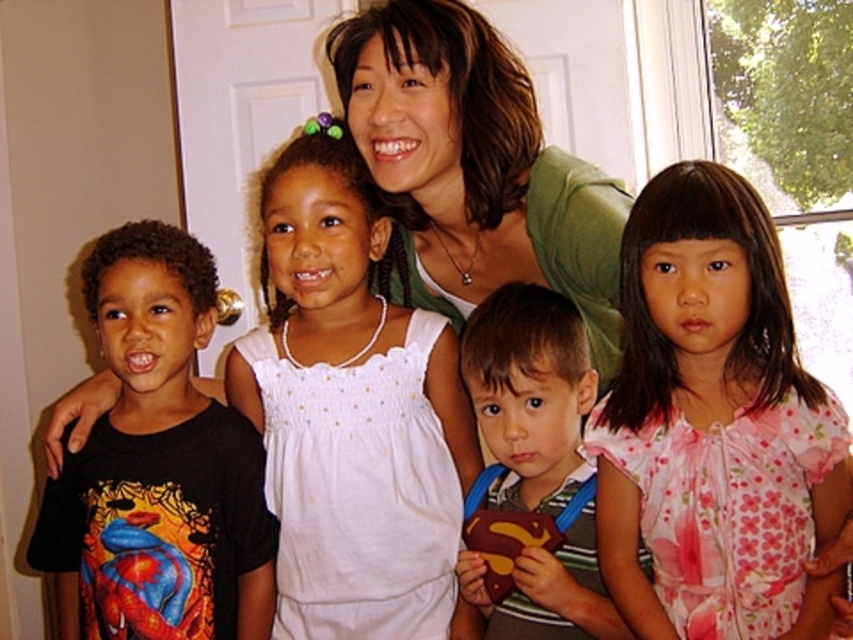
Question: Which object is the closest to the green fabric shirt at center?

Choices:
 (A) black t-shirt at left
 (B) matte brown plush toy at center

Answer: (B)

Question: Is black t-shirt at left below green fabric shirt at center?

Choices:
 (A) yes
 (B) no

Answer: (A)

Question: Which point is closer to the camera?

Choices:
 (A) (456, 36)
 (B) (428, 593)

Answer: (A)

Question: Can you confirm if white cotton dress at center is positioned below matte brown plush toy at center?

Choices:
 (A) no
 (B) yes

Answer: (A)

Question: Considering the relative positions of pink floral blouse at center and black t-shirt at left in the image provided, where is pink floral blouse at center located with respect to black t-shirt at left?

Choices:
 (A) right
 (B) left

Answer: (A)

Question: Considering the real-world distances, which object is farthest from the pink floral blouse at center?

Choices:
 (A) black t-shirt at left
 (B) matte brown plush toy at center
 (C) green fabric shirt at center
 (D) white cotton dress at center

Answer: (A)